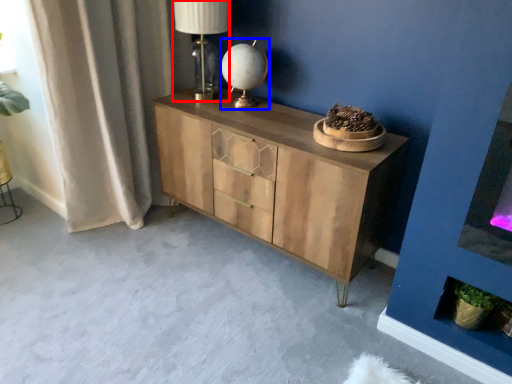
Question: Which of the following is the closest to the observer, table lamp (highlighted by a red box) or table lamp (highlighted by a blue box)?

Choices:
 (A) table lamp
 (B) table lamp

Answer: (A)